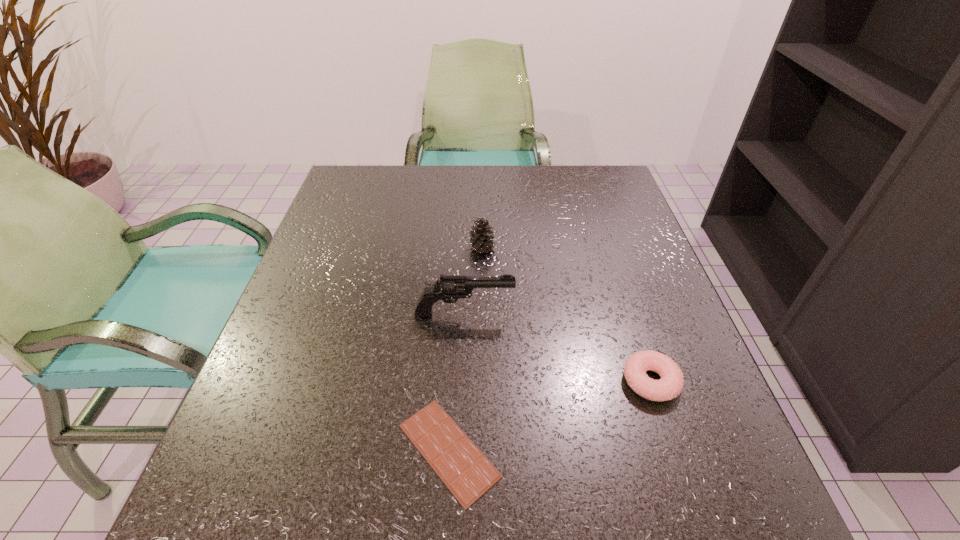
Identify the location of free space located 0.070m on the left of the shortest object. (350, 450).

I want to click on object that is positioned at the near edge, so click(x=468, y=474).

Locate an element on the screen. The width and height of the screenshot is (960, 540). object present at the right edge is located at coordinates point(671,383).

Identify the location of blank area at the far edge. (513, 171).

In the image, there is a desktop. What are the coordinates of `vacant region at the near edge` in the screenshot? It's located at pos(372,538).

Identify the location of vacant space at the left edge of the desktop. The height and width of the screenshot is (540, 960). (282, 463).

This screenshot has width=960, height=540. What are the coordinates of `vacant area at the right edge of the desktop` in the screenshot? It's located at (668, 319).

I want to click on vacant space at the far left corner of the desktop, so click(x=366, y=184).

At what (x,y) coordinates should I click in order to perform the action: click on vacant space at the far right corner of the desktop. Please return your answer as a coordinate pair (x, y). The height and width of the screenshot is (540, 960). Looking at the image, I should click on (578, 175).

Where is `free space between the shortest object and the gun`? This screenshot has height=540, width=960. free space between the shortest object and the gun is located at coordinates (456, 382).